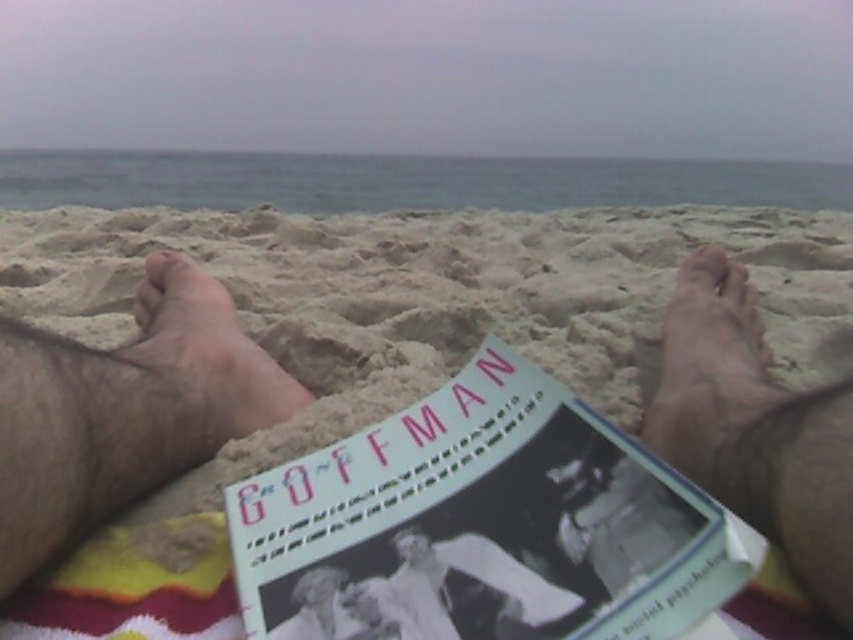
Question: Among these points, which one is nearest to the camera?

Choices:
 (A) (163, 324)
 (B) (723, 282)
 (C) (180, 588)

Answer: (C)

Question: Which point appears closest to the camera in this image?

Choices:
 (A) (132, 356)
 (B) (753, 340)

Answer: (A)

Question: Observing the image, what is the correct spatial positioning of white paper book at center in reference to hairy skin at center?

Choices:
 (A) left
 (B) right

Answer: (B)

Question: Where is beige sand at center located in relation to white paper book at center in the image?

Choices:
 (A) left
 (B) right

Answer: (B)

Question: Which object is closer to the camera taking this photo?

Choices:
 (A) brown hairy foot at left
 (B) beige sand at center

Answer: (B)

Question: Can you confirm if hairy skin at center is bigger than smooth skin feet at lower right?

Choices:
 (A) yes
 (B) no

Answer: (B)